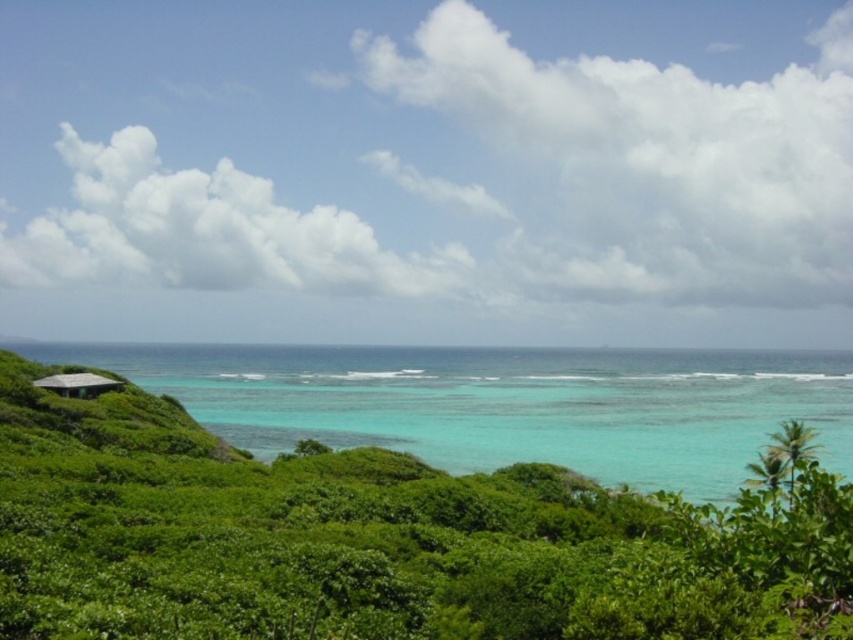
Is clear blue water at left below gray concrete hut at lower left?

Yes.

Can you confirm if clear blue water at left is positioned above gray concrete hut at lower left?

Incorrect, clear blue water at left is not positioned above gray concrete hut at lower left.

This screenshot has width=853, height=640. Describe the element at coordinates (503, 403) in the screenshot. I see `clear blue water at left` at that location.

Locate an element on the screen. The width and height of the screenshot is (853, 640). clear blue water at left is located at coordinates (503, 403).